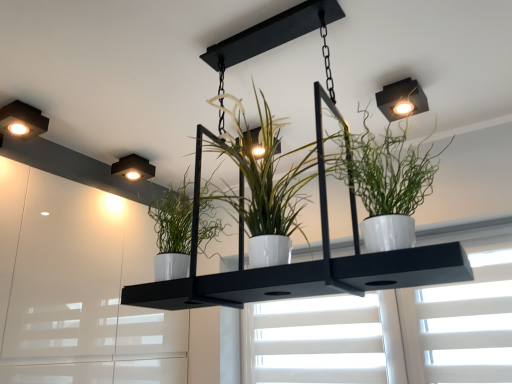
Question: Is white glossy pot at upper right, the 1th houseplant positioned from the right, bigger or smaller than white glossy cabinet at left?

Choices:
 (A) small
 (B) big

Answer: (A)

Question: In terms of width, does white glossy pot at upper right, the 1th houseplant positioned from the right, look wider or thinner when compared to white glossy cabinet at left?

Choices:
 (A) wide
 (B) thin

Answer: (B)

Question: Considering the real-world distances, which object is farthest from the matte black square light at upper left, which appears as the second lamp when viewed from the back?

Choices:
 (A) matte black square light fixture at upper left, which appears as the first lamp when viewed from the back
 (B) white matte window at center
 (C) matte black square light at upper right
 (D) white glossy pot at center, arranged as the 2th houseplant when viewed from the right
 (E) white glossy cabinet at left

Answer: (B)

Question: Which object is positioned farthest from the matte black square light fixture at upper left, which is counted as the second lamp, starting from the left?

Choices:
 (A) matte black square light at upper right
 (B) white glossy cabinet at left
 (C) white glossy pot at upper right, the 1th houseplant positioned from the right
 (D) matte black square light at upper left, acting as the 1th lamp starting from the left
 (E) white glossy pot at center, arranged as the 2th houseplant when viewed from the right

Answer: (C)